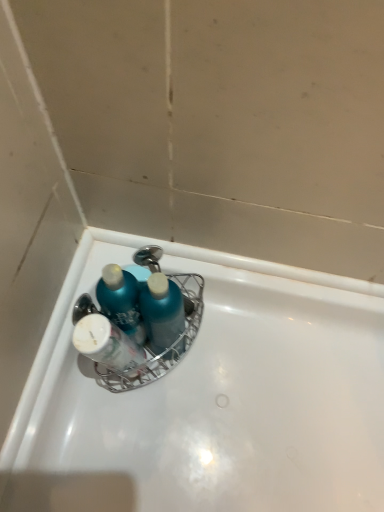
Question: From a real-world perspective, is white glossy bottle at center physically below blue glossy bottle at upper center?

Choices:
 (A) no
 (B) yes

Answer: (A)

Question: Is white glossy bottle at center to the left of blue glossy bottle at upper center from the viewer's perspective?

Choices:
 (A) yes
 (B) no

Answer: (A)

Question: Is blue glossy bottle at upper center a part of white glossy bottle at center?

Choices:
 (A) no
 (B) yes

Answer: (A)

Question: Can you confirm if white glossy bottle at center is shorter than blue glossy bottle at upper center?

Choices:
 (A) no
 (B) yes

Answer: (A)

Question: Is white glossy bottle at center placed right next to blue glossy bottle at upper center?

Choices:
 (A) no
 (B) yes

Answer: (B)

Question: In terms of height, does white glossy bathtub at center look taller or shorter compared to white glossy bottle at center?

Choices:
 (A) short
 (B) tall

Answer: (A)

Question: Is white glossy bathtub at center wider or thinner than white glossy bottle at center?

Choices:
 (A) thin
 (B) wide

Answer: (B)

Question: From the image's perspective, is white glossy bathtub at center above or below white glossy bottle at center?

Choices:
 (A) above
 (B) below

Answer: (B)

Question: From a real-world perspective, is white glossy bathtub at center physically located above or below white glossy bottle at center?

Choices:
 (A) below
 (B) above

Answer: (A)

Question: Which is correct: white glossy bottle at center is inside white glossy bathtub at center, or outside of it?

Choices:
 (A) inside
 (B) outside

Answer: (B)

Question: In terms of width, does white glossy bottle at center look wider or thinner when compared to white glossy bathtub at center?

Choices:
 (A) wide
 (B) thin

Answer: (B)

Question: From a real-world perspective, is white glossy bottle at center positioned above or below white glossy bathtub at center?

Choices:
 (A) above
 (B) below

Answer: (A)

Question: Is white glossy bottle at center bigger or smaller than white glossy bathtub at center?

Choices:
 (A) small
 (B) big

Answer: (A)

Question: Which is correct: white glossy bottle at center is inside blue glossy bottle at upper center, or outside of it?

Choices:
 (A) inside
 (B) outside

Answer: (B)

Question: Considering the positions of white glossy bottle at center and blue glossy bottle at upper center in the image, is white glossy bottle at center bigger or smaller than blue glossy bottle at upper center?

Choices:
 (A) big
 (B) small

Answer: (A)